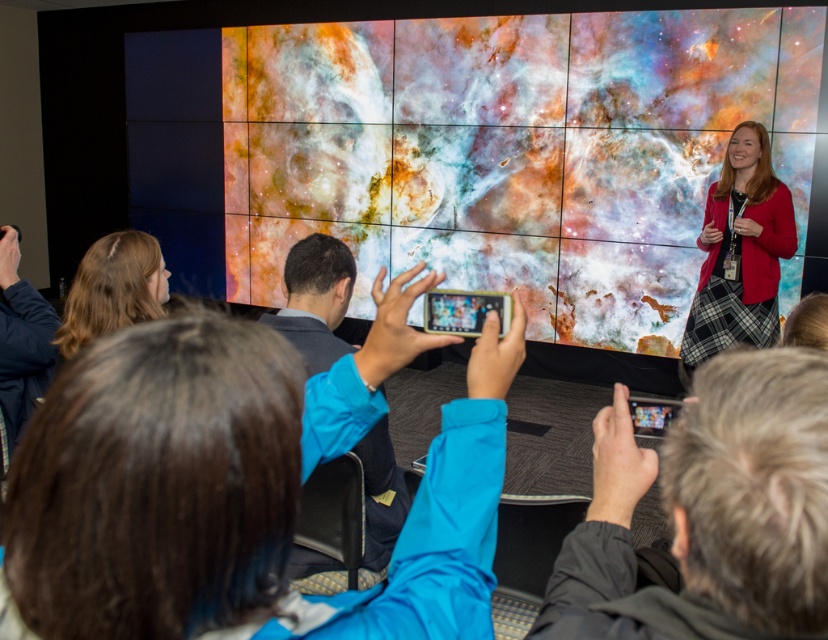
You are planning to send a drone from the plaid skirt at right to the black glossy tablet at upper center. The drone can only travel in a straight line. What is the minimum distance the drone must cover to reach the tablet?

The minimum distance the drone must cover is 8.48 feet, as the plaid skirt at right is 8.48 feet from the black glossy tablet at upper center.

You are organizing a photography event and want to ensure that the multicolored fabric screen at center and the blue fabric jacket at center are both visible in the photo. Given their sizes, which object should you focus on to frame the shot properly?

The multicolored fabric screen at center is larger in size than the blue fabric jacket at center, so you should focus on framing the multicolored fabric screen at center first to ensure it fits well in the photo, and then adjust to include the smaller blue fabric jacket at center.